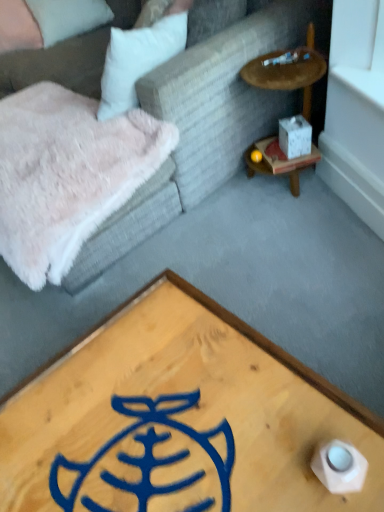
The width and height of the screenshot is (384, 512). In order to click on free space above white matte cube at right (from a real-world perspective) in this screenshot , I will do `click(279, 147)`.